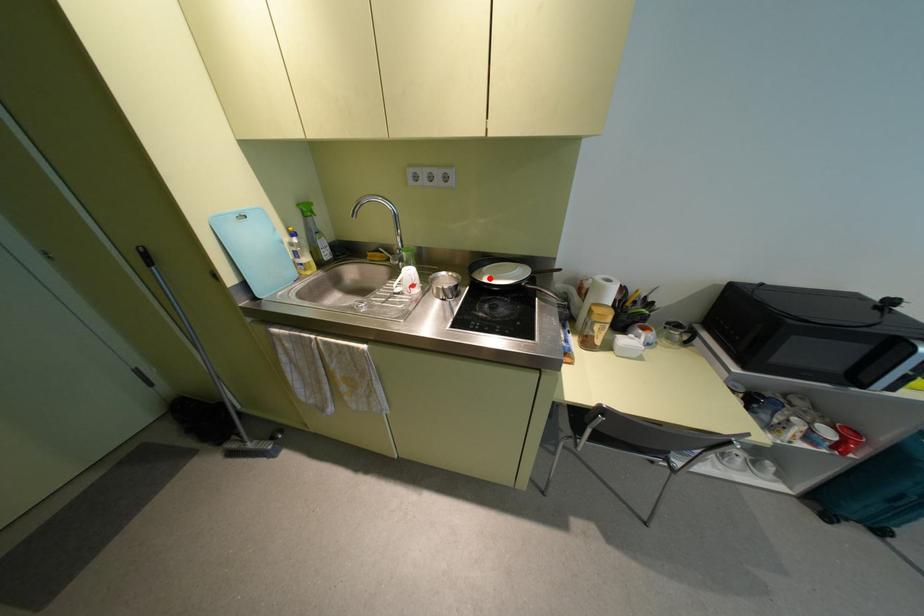
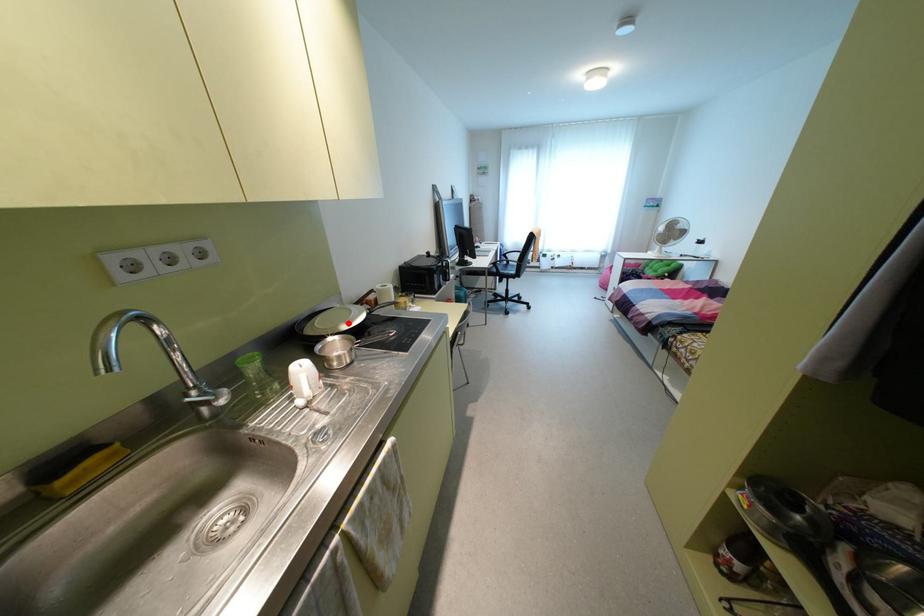
I am providing you with two images of the same scene from different viewpoints. A red point is marked on the first image and another point is marked on the second image. Do the highlighted points in image1 and image2 indicate the same real-world spot?

Yes